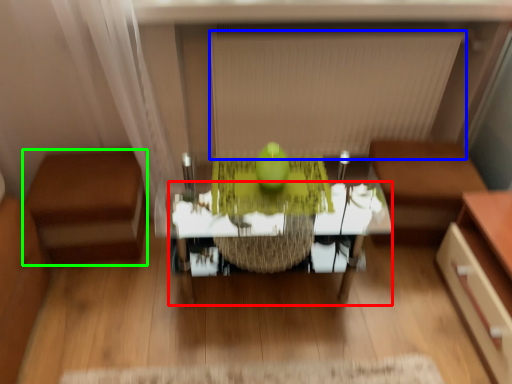
Question: Which object is positioned closest to table (highlighted by a red box)? Select from blind (highlighted by a blue box) and furniture (highlighted by a green box).

Choices:
 (A) blind
 (B) furniture

Answer: (B)